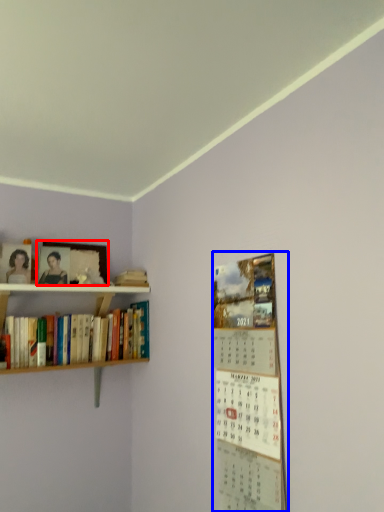
Question: Among these objects, which one is nearest to the camera, picture frame (highlighted by a red box) or bulletin board (highlighted by a blue box)?

Choices:
 (A) picture frame
 (B) bulletin board

Answer: (B)